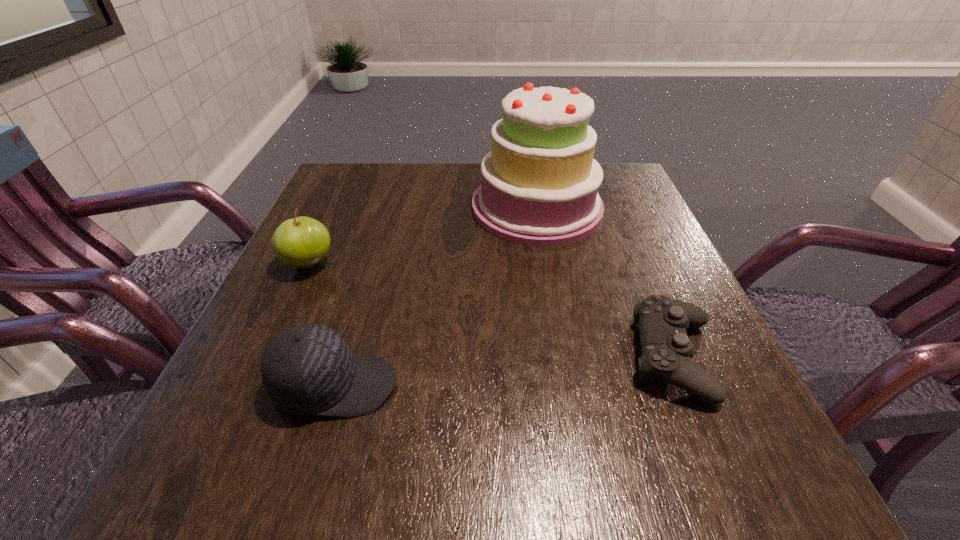
The image size is (960, 540). I want to click on free space between the baseball cap and the farthest object, so click(x=436, y=296).

This screenshot has width=960, height=540. I want to click on vacant point located between the control and the apple, so click(x=492, y=311).

You are a GUI agent. You are given a task and a screenshot of the screen. Output one action in this format:
    pyautogui.click(x=<x>, y=<y>)
    Task: Click on the object that ranks as the closest to the farthest object
    This screenshot has height=540, width=960.
    Given the screenshot: What is the action you would take?
    pyautogui.click(x=667, y=351)

Locate an element on the screen. The width and height of the screenshot is (960, 540). object that stands as the second closest to the baseball cap is located at coordinates (539, 187).

The width and height of the screenshot is (960, 540). In order to click on vacant area in the image that satisfies the following two spatial constraints: 1. on the back side of the apple; 2. on the right side of the cake in this screenshot , I will do `click(334, 208)`.

You are a GUI agent. You are given a task and a screenshot of the screen. Output one action in this format:
    pyautogui.click(x=<x>, y=<y>)
    Task: Click on the vacant space that satisfies the following two spatial constraints: 1. on the back side of the apple; 2. on the right side of the tallest object
    The width and height of the screenshot is (960, 540).
    Given the screenshot: What is the action you would take?
    pyautogui.click(x=334, y=208)